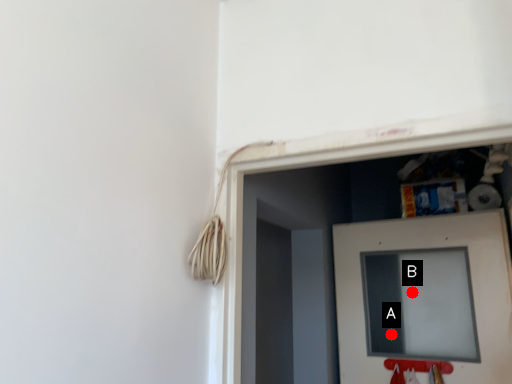
Question: Two points are circled on the image, labeled by A and B beside each circle. Which point is farther from the camera taking this photo?

Choices:
 (A) A is further
 (B) B is further

Answer: (B)